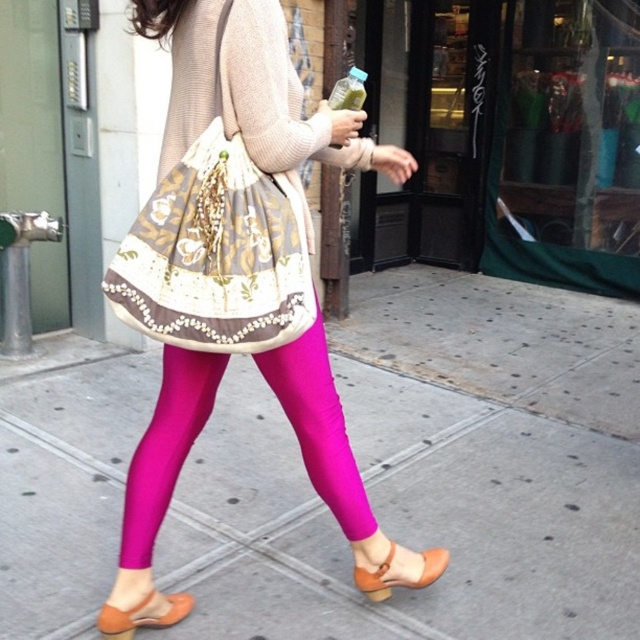
Is point (192, 378) farther from viewer compared to point (100, 627)?

That is True.

Image resolution: width=640 pixels, height=640 pixels. Describe the element at coordinates (317, 426) in the screenshot. I see `matte magenta leggings at center` at that location.

At what (x,y) coordinates should I click in order to perform the action: click on matte magenta leggings at center. Please return your answer as a coordinate pair (x, y). Looking at the image, I should click on (317, 426).

Does point (202, 204) come farther from viewer compared to point (106, 628)?

No, (202, 204) is closer to viewer.

Who is shorter, embroidered fabric bag at center or matte orange sandal at lower center?

Standing shorter between the two is matte orange sandal at lower center.

Identify the location of embroidered fabric bag at center. (x=216, y=256).

Based on the photo, is pink fabric leggings at center to the right of matte pink leggings at center from the viewer's perspective?

Correct, you'll find pink fabric leggings at center to the right of matte pink leggings at center.

Is point (6, 541) behind point (184, 269)?

Yes, it is behind point (184, 269).

Does point (83, 509) come farther from viewer compared to point (296, 193)?

Yes, it is behind point (296, 193).

At what (x,y) coordinates should I click in order to perform the action: click on pink fabric leggings at center. Please return your answer as a coordinate pair (x, y). Looking at the image, I should click on (429, 474).